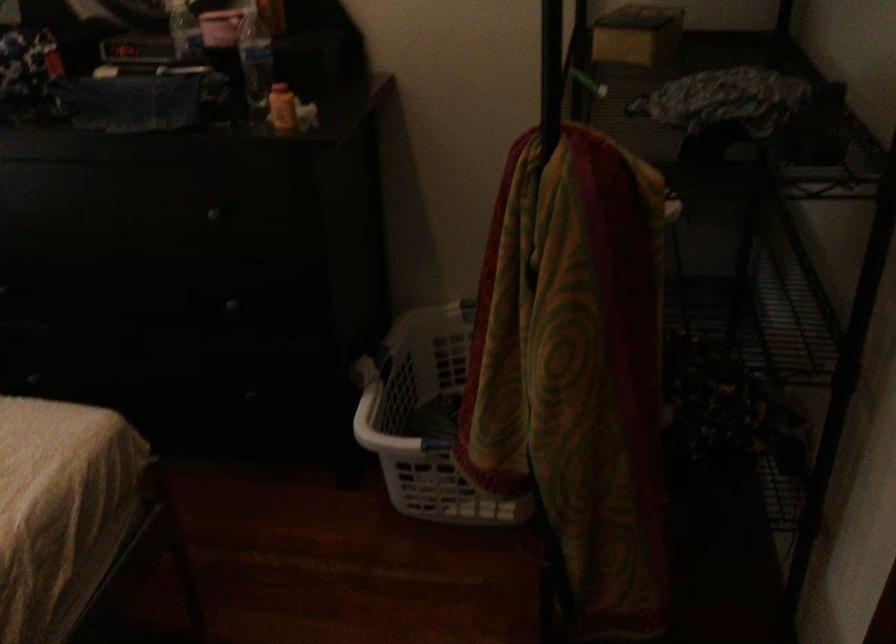
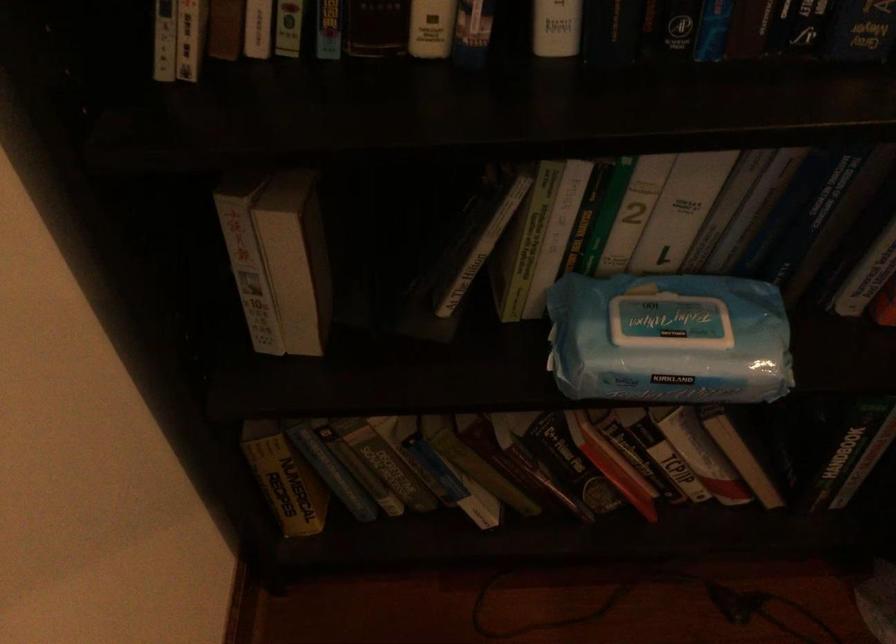
Which direction would the cameraman need to move to produce the second image?

The cameraman walked toward left, forward.